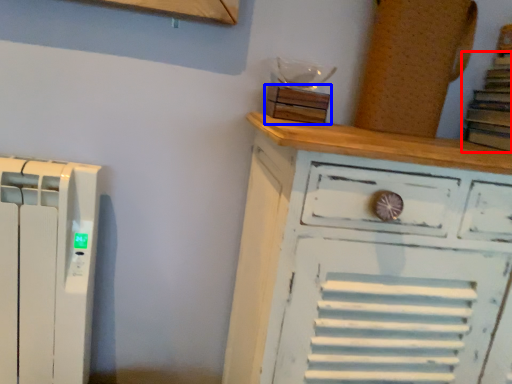
Question: Among these objects, which one is farthest to the camera, book (highlighted by a red box) or wood (highlighted by a blue box)?

Choices:
 (A) book
 (B) wood

Answer: (B)